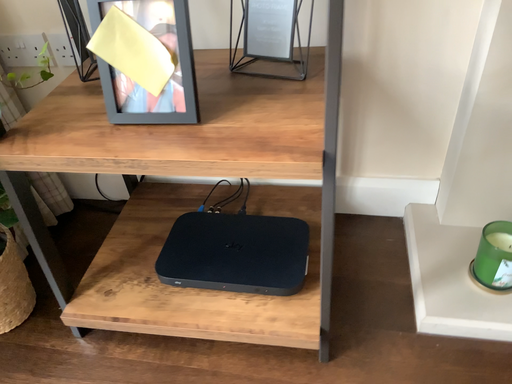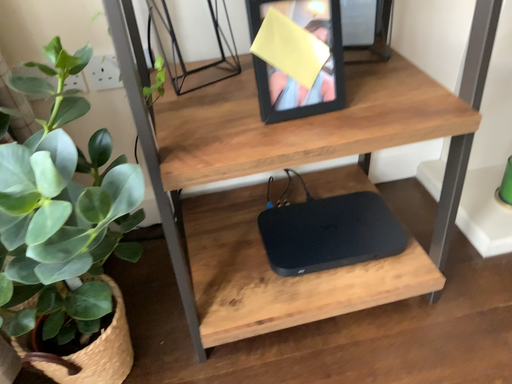
Question: How did the camera likely rotate when shooting the video?

Choices:
 (A) rotated right
 (B) rotated left

Answer: (A)